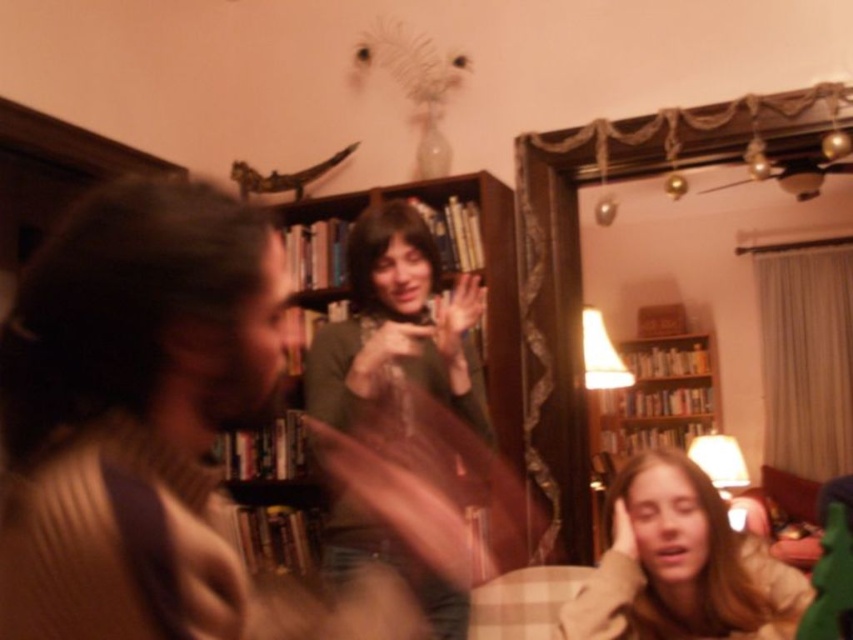
You are standing in the living room and see the matte green sweater at center and the wooden bookshelf at center. Which object is nearer to you?

The matte green sweater at center is closer to the viewer than the wooden bookshelf at center, so the matte green sweater at center is nearer to you.

You are organizing a small party in the living room and need to place a large centerpiece on the table. Given the scene, which object between the blonde hair at lower right and the wooden bookshelf at center should you avoid placing the centerpiece near?

You should avoid placing the centerpiece near the blonde hair at lower right because it occupies less space than the wooden bookshelf at center, making it a less stable or suitable area for a large centerpiece.